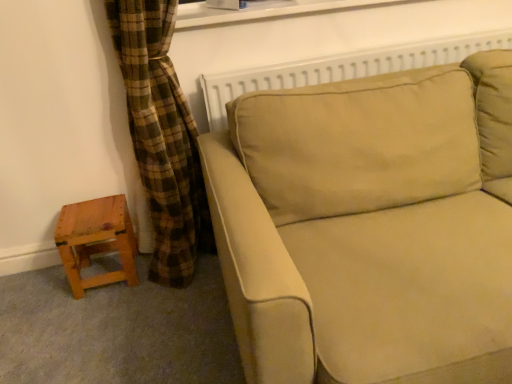
Question: From a real-world perspective, is white plastic window frame at upper center positioned above or below wooden stool at lower left?

Choices:
 (A) above
 (B) below

Answer: (A)

Question: Is point (266, 8) positioned closer to the camera than point (99, 231)?

Choices:
 (A) closer
 (B) farther

Answer: (B)

Question: Which object is positioned farthest from the white plastic window frame at upper center?

Choices:
 (A) wooden stool at lower left
 (B) beige fabric couch at center

Answer: (A)

Question: Which object is the closest to the beige fabric couch at center?

Choices:
 (A) wooden stool at lower left
 (B) white plastic window frame at upper center

Answer: (B)